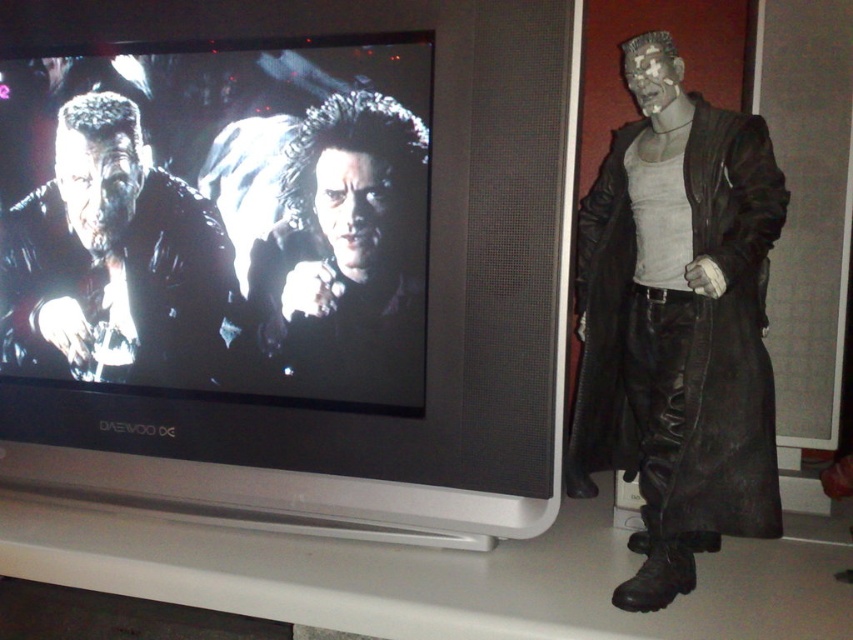
Find the location of a particular element. The height and width of the screenshot is (640, 853). matte black television at center is located at coordinates (427, 298).

Does matte black television at center have a greater width compared to matte black coat at right?

Indeed, matte black television at center has a greater width compared to matte black coat at right.

Measure the distance between point [448,356] and camera.

Point [448,356] and camera are 1.14 meters apart.

Find the location of a particular element. The image size is (853, 640). matte black television at center is located at coordinates (427, 298).

Between point (523, 54) and point (10, 321), which one is positioned behind?

The point (10, 321) is more distant.

Measure the distance from matte black television at center to matte black leather jacket at left.

The distance of matte black television at center from matte black leather jacket at left is 7.66 inches.

Between point (212, 426) and point (135, 250), which one is positioned behind?

The point (135, 250) is behind.

Find the location of `matte black television at center`. matte black television at center is located at coordinates pyautogui.click(x=427, y=298).

Is matte black leather jacket at left wider than shiny black hair at center?

Yes, matte black leather jacket at left is wider than shiny black hair at center.

Find the location of a particular element. The height and width of the screenshot is (640, 853). matte black leather jacket at left is located at coordinates (113, 260).

Locate an element on the screen. This screenshot has width=853, height=640. matte black leather jacket at left is located at coordinates (113, 260).

You are a GUI agent. You are given a task and a screenshot of the screen. Output one action in this format:
    pyautogui.click(x=<x>, y=<y>)
    Task: Click on the matte black leather jacket at left
    Image resolution: width=853 pixels, height=640 pixels.
    Given the screenshot: What is the action you would take?
    tap(113, 260)